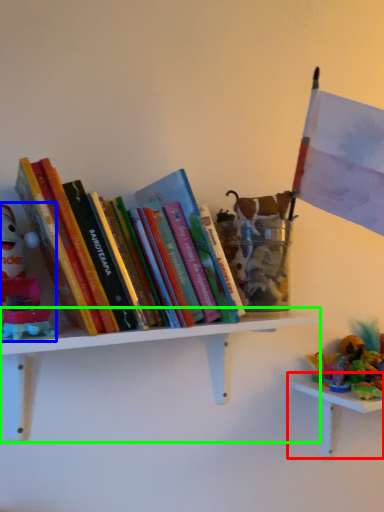
Question: Which object is the closest to the table (highlighted by a red box)? Choose among these: toy (highlighted by a blue box) or shelf (highlighted by a green box).

Choices:
 (A) toy
 (B) shelf

Answer: (B)